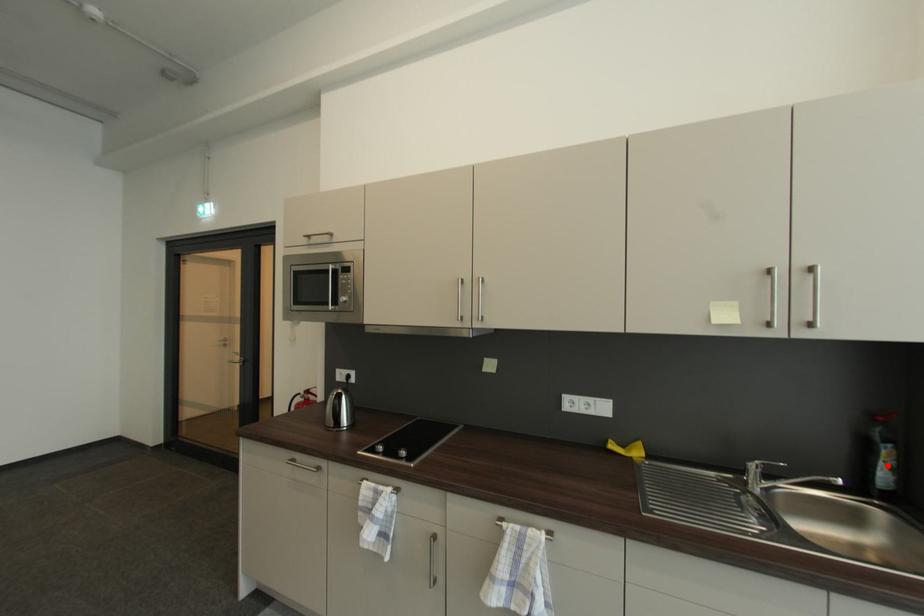
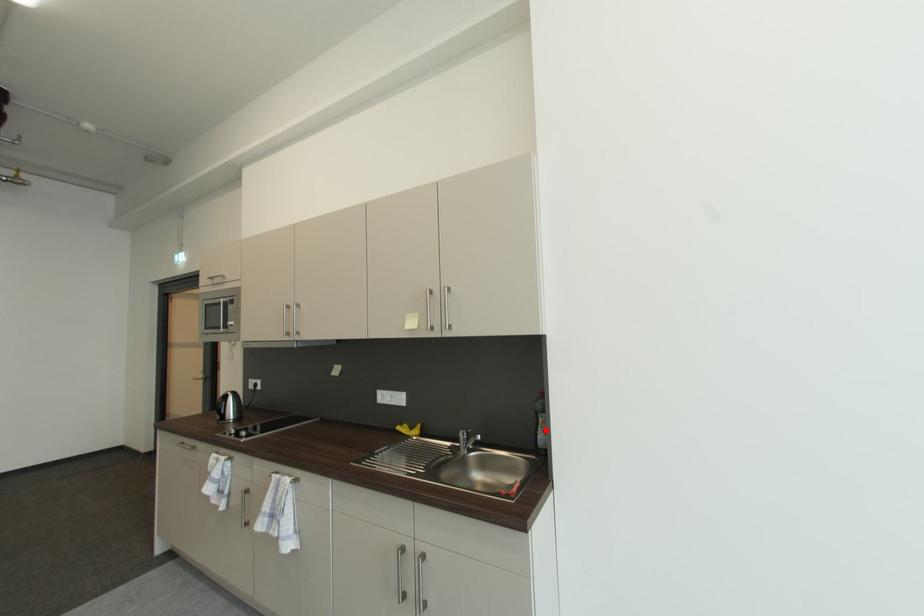
I am providing you with two images of the same scene from different viewpoints. A red point is marked on the first image and another point is marked on the second image. Does the point marked in image1 correspond to the same location as the one in image2?

Yes